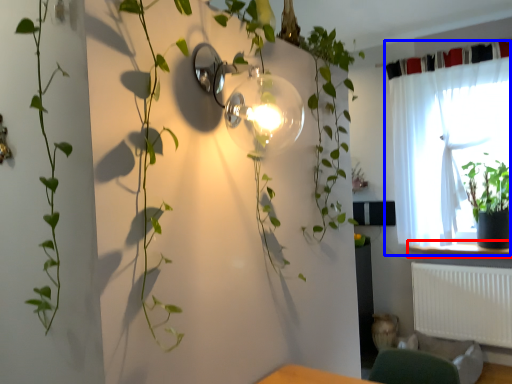
Question: Which point is closer to the camera, window sill (highlighted by a red box) or curtain (highlighted by a blue box)?

Choices:
 (A) window sill
 (B) curtain

Answer: (B)